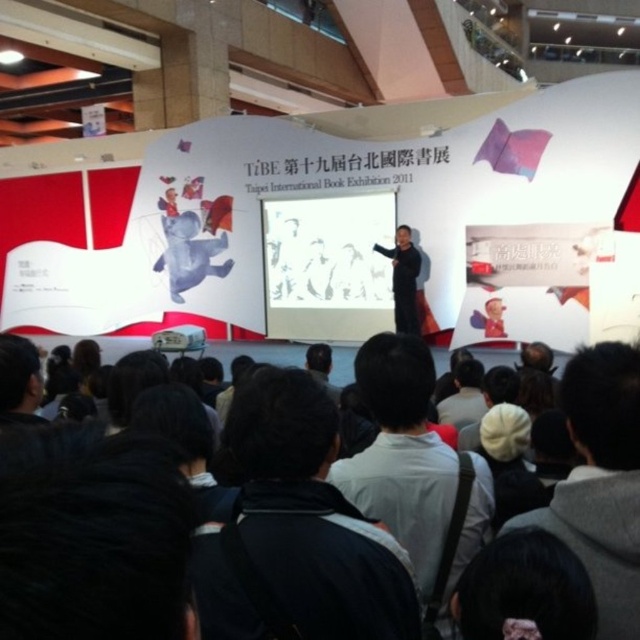
You are standing at the exhibition hall and want to reach the stage where the speaker is. The point you need to reach is marked as point (x=483, y=536). Can you walk straight to it from your current position?

The distance between you and point (x=483, y=536) is 3.34 meters, so yes, you can walk straight to it as there is no obstruction mentioned in the scene description.

You are a photographer positioned at the front of the stage at the Taipei International Book Exhibition 2011. You need to capture a photo that includes both the speaker on stage and the event banner. The speaker is located at point (360, 378), and the banner is at point (628, 636). Based on their positions, which object is closer to you?

Point (360, 378) is closer to you than point (628, 636) because the speaker is positioned further forward on the stage compared to the banner.

You are attending the Taipei International Book Exhibition in 2011 and notice two items on the stage. The white fabric at center and the black matte suit at center. From the audience perspective, which item is located to the left?

The white fabric at center is positioned on the left side of the black matte suit at center, so from the audience perspective, the white fabric at center is located to the left.